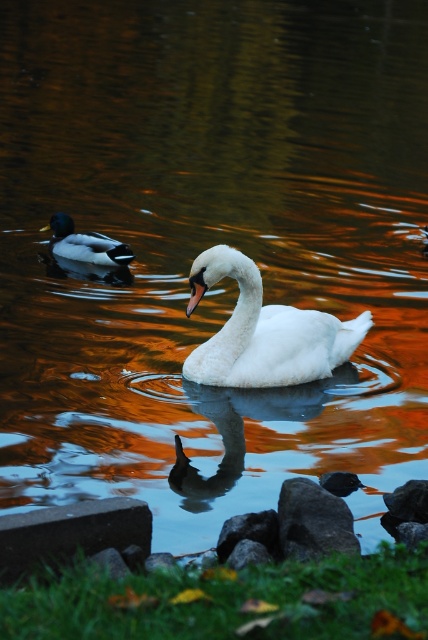
Consider the image. You are a photographer trying to capture both the smooth gray rock at lower center and the green glossy duck at left in a single frame. Based on their positions, which object should you adjust your camera to focus on first to ensure both are in the shot?

The green glossy duck at left should be focused on first since the smooth gray rock at lower center is to the right of it, meaning the duck is positioned further to the left and closer to the edge of the frame. By centering the duck first, you can then adjust the camera to include the rock to its right without losing the duck from the shot.

You are standing at the edge of the water and want to place a small statue on the gray concrete at lower left and the smooth gray rock at lower center. Which surface is higher up?

The gray concrete at lower left is located above the smooth gray rock at lower center, so it is higher up.